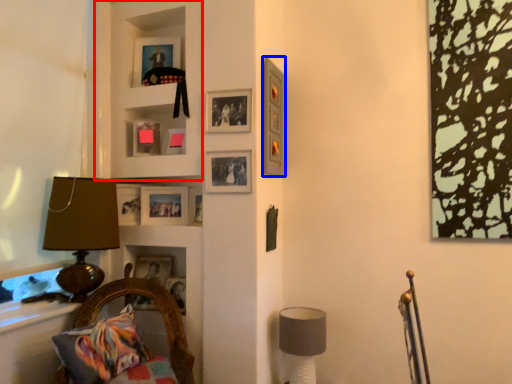
Question: Among these objects, which one is farthest to the camera, cabinet (highlighted by a red box) or picture frame (highlighted by a blue box)?

Choices:
 (A) cabinet
 (B) picture frame

Answer: (A)